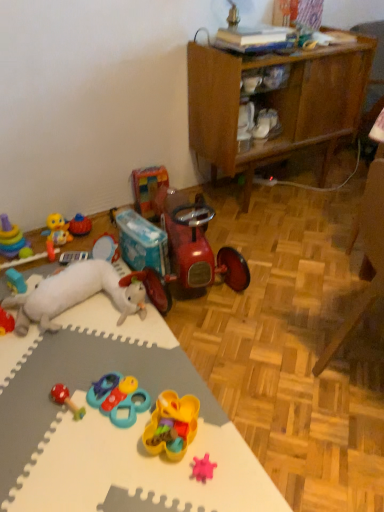
Image resolution: width=384 pixels, height=512 pixels. In order to click on multicolored plastic rings at left, which ranks as the 12th toy in right-to-left order in this screenshot , I will do `click(11, 238)`.

In order to face pink rubber star at lower center, which is counted as the 1th toy, starting from the right, should I rotate leftwards or rightwards?

You should rotate right by 1.676 degrees.

What do you see at coordinates (275, 103) in the screenshot?
I see `wooden cabinet at upper right` at bounding box center [275, 103].

What do you see at coordinates (148, 189) in the screenshot? I see `multicolored plastic blocks at upper center, which ranks as the 4th toy in right-to-left order` at bounding box center [148, 189].

This screenshot has height=512, width=384. What do you see at coordinates (266, 124) in the screenshot?
I see `white matte shoe at center` at bounding box center [266, 124].

Where is `rubberized plastic toy at left, the eleventh toy positioned from the right`? This screenshot has height=512, width=384. rubberized plastic toy at left, the eleventh toy positioned from the right is located at coordinates (31, 257).

The image size is (384, 512). In order to click on multicolored plastic rings at left, which ranks as the 12th toy in right-to-left order in this screenshot , I will do `click(11, 238)`.

In the scene shown: Is rubber duck at center, the 6th toy when ordered from left to right, to the left of white matte shoe at center from the viewer's perspective?

Indeed, rubber duck at center, the 6th toy when ordered from left to right, is positioned on the left side of white matte shoe at center.

Is rubber duck at center, positioned as the 7th toy in right-to-left order, completely or partially outside of white matte shoe at center?

Yes, rubber duck at center, positioned as the 7th toy in right-to-left order, is not within white matte shoe at center.

Considering the sizes of rubber duck at center, the 6th toy when ordered from left to right, and white matte shoe at center in the image, is rubber duck at center, the 6th toy when ordered from left to right, bigger or smaller than white matte shoe at center?

rubber duck at center, the 6th toy when ordered from left to right, is smaller than white matte shoe at center.

Considering the sizes of rubber duck at center, the 6th toy when ordered from left to right, and white matte shoe at center in the image, is rubber duck at center, the 6th toy when ordered from left to right, wider or thinner than white matte shoe at center?

rubber duck at center, the 6th toy when ordered from left to right, is thinner than white matte shoe at center.

Is multicolored plastic rings at left, which ranks as the 12th toy in right-to-left order, facing towards white matte shoe at center?

No, multicolored plastic rings at left, which ranks as the 12th toy in right-to-left order, is not facing towards white matte shoe at center.

Consider the image. Is multicolored plastic rings at left, which ranks as the 12th toy in right-to-left order, closer to camera compared to white matte shoe at center?

Yes, the depth of multicolored plastic rings at left, which ranks as the 12th toy in right-to-left order, is less than that of white matte shoe at center.

Does multicolored plastic rings at left, the first toy viewed from the left, have a greater height compared to white matte shoe at center?

Correct, multicolored plastic rings at left, the first toy viewed from the left, is much taller as white matte shoe at center.

Is wooden cabinet at upper right oriented away from white foam mat at lower left?

No.

From a real-world perspective, is wooden cabinet at upper right below white foam mat at lower left?

No, from a real-world perspective, wooden cabinet at upper right is not beneath white foam mat at lower left.

Does wooden cabinet at upper right come behind white foam mat at lower left?

Yes, wooden cabinet at upper right is behind white foam mat at lower left.

Based on their sizes in the image, would you say wooden cabinet at upper right is bigger or smaller than white foam mat at lower left?

Clearly, wooden cabinet at upper right is larger in size than white foam mat at lower left.

Does multicolored plastic blocks at upper center, placed as the ninth toy when sorted from left to right, have a greater width compared to shiny red tricycle at center, acting as the third toy starting from the right?

Incorrect, the width of multicolored plastic blocks at upper center, placed as the ninth toy when sorted from left to right, does not surpass that of shiny red tricycle at center, acting as the third toy starting from the right.

Which object is closer to the camera, multicolored plastic blocks at upper center, placed as the ninth toy when sorted from left to right, or shiny red tricycle at center, which appears as the 10th toy when viewed from the left?

Positioned in front is shiny red tricycle at center, which appears as the 10th toy when viewed from the left.

Looking at this image, is multicolored plastic blocks at upper center, placed as the ninth toy when sorted from left to right, situated inside shiny red tricycle at center, acting as the third toy starting from the right, or outside?

multicolored plastic blocks at upper center, placed as the ninth toy when sorted from left to right, is spatially situated outside shiny red tricycle at center, acting as the third toy starting from the right.

Does point (148, 217) come closer to viewer compared to point (179, 282)?

No, it is behind (179, 282).

Does white foam mat at lower left turn towards white matte shoe at center?

No, white foam mat at lower left is not oriented towards white matte shoe at center.

Does white foam mat at lower left appear on the right side of white matte shoe at center?

In fact, white foam mat at lower left is to the left of white matte shoe at center.

Is the position of white foam mat at lower left more distant than that of white matte shoe at center?

That is False.

Is white foam mat at lower left taller than white matte shoe at center?

No, white foam mat at lower left is not taller than white matte shoe at center.

Is rubberized red and green toy at lower left, the 7th toy from the left, facing towards wooden cabinet at upper right?

No, rubberized red and green toy at lower left, the 7th toy from the left, is not turned towards wooden cabinet at upper right.

From a real-world perspective, is rubberized red and green toy at lower left, the 6th toy positioned from the right, above or below wooden cabinet at upper right?

From a real-world perspective, rubberized red and green toy at lower left, the 6th toy positioned from the right, is physically below wooden cabinet at upper right.

Is rubberized red and green toy at lower left, the 7th toy from the left, at the right side of wooden cabinet at upper right?

In fact, rubberized red and green toy at lower left, the 7th toy from the left, is to the left of wooden cabinet at upper right.

Who is bigger, rubberized red and green toy at lower left, the 7th toy from the left, or wooden cabinet at upper right?

Bigger between the two is wooden cabinet at upper right.

Could you tell me if rubber duck at center, positioned as the 7th toy in right-to-left order, is facing rubberized plastic toy at left, the eleventh toy positioned from the right?

Yes, rubber duck at center, positioned as the 7th toy in right-to-left order, is oriented towards rubberized plastic toy at left, the eleventh toy positioned from the right.

From a real-world perspective, is rubber duck at center, positioned as the 7th toy in right-to-left order, over rubberized plastic toy at left, which ranks as the second toy in left-to-right order?

Yes.

From the image's perspective, relative to rubberized plastic toy at left, which ranks as the second toy in left-to-right order, is rubber duck at center, the 6th toy when ordered from left to right, above or below?

rubber duck at center, the 6th toy when ordered from left to right, is situated higher than rubberized plastic toy at left, which ranks as the second toy in left-to-right order, in the image.

Can you confirm if rubber duck at center, positioned as the 7th toy in right-to-left order, is positioned to the left of rubberized plastic toy at left, which ranks as the second toy in left-to-right order?

No.

You are a GUI agent. You are given a task and a screenshot of the screen. Output one action in this format:
    pyautogui.click(x=<x>, y=<y>)
    Task: Click on the footwear on the right of rubber duck at center, the 6th toy when ordered from left to right
    This screenshot has height=512, width=384.
    Given the screenshot: What is the action you would take?
    pyautogui.click(x=266, y=124)

The height and width of the screenshot is (512, 384). I want to click on footwear behind the multicolored plastic rings at left, the first toy viewed from the left, so click(x=266, y=124).

From the image, which object appears to be farther from shiny red tricycle at center, acting as the third toy starting from the right, pink rubber star at lower center, which is counted as the 1th toy, starting from the right, or multicolored plastic blocks at upper center, placed as the ninth toy when sorted from left to right?

pink rubber star at lower center, which is counted as the 1th toy, starting from the right, is further to shiny red tricycle at center, acting as the third toy starting from the right.

Based on their spatial positions, is shiny red tricycle at center, which appears as the 10th toy when viewed from the left, or rubberized red and green toy at lower left, the 6th toy positioned from the right, closer to white foam mat at lower left?

Among the two, rubberized red and green toy at lower left, the 6th toy positioned from the right, is located nearer to white foam mat at lower left.

Based on their spatial positions, is teal plastic toy at center, the eighth toy viewed from the left, or pink rubber star at lower center, placed as the twelfth toy when sorted from left to right, further from rubberized red and green toy at lower left, the 7th toy from the left?

Among the two, pink rubber star at lower center, placed as the twelfth toy when sorted from left to right, is located further to rubberized red and green toy at lower left, the 7th toy from the left.

Based on the photo, when comparing their distances from rubberized plastic toy at left, which ranks as the second toy in left-to-right order, does rubber duck at left, positioned as the ninth toy in right-to-left order, or shiny red tricycle at center, which appears as the 10th toy when viewed from the left, seem further?

Based on the image, shiny red tricycle at center, which appears as the 10th toy when viewed from the left, appears to be further to rubberized plastic toy at left, which ranks as the second toy in left-to-right order.

Consider the image. Based on their spatial positions, is wooden cabinet at upper right or rubberized red and green toy at lower left, the 6th toy positioned from the right, closer to teal plastic toy at center, the eighth toy viewed from the left?

The object closer to teal plastic toy at center, the eighth toy viewed from the left, is rubberized red and green toy at lower left, the 6th toy positioned from the right.

Estimate the real-world distances between objects in this image. Which object is closer to shiny red tricycle at center, acting as the third toy starting from the right, rubberized red and green toy at lower left, the 6th toy positioned from the right, or white matte shoe at center?

rubberized red and green toy at lower left, the 6th toy positioned from the right, is positioned closer to the anchor shiny red tricycle at center, acting as the third toy starting from the right.

Estimate the real-world distances between objects in this image. Which object is further from rubberized plastic toy at left, the eleventh toy positioned from the right, shiny red tricycle at center, acting as the third toy starting from the right, or pink rubber star at lower center, placed as the twelfth toy when sorted from left to right?

pink rubber star at lower center, placed as the twelfth toy when sorted from left to right, is positioned further to the anchor rubberized plastic toy at left, the eleventh toy positioned from the right.

From the image, which object appears to be farther from white matte shoe at center, rubber duck at left, positioned as the ninth toy in right-to-left order, or multicolored plastic blocks at upper center, which ranks as the 4th toy in right-to-left order?

rubber duck at left, positioned as the ninth toy in right-to-left order, lies further to white matte shoe at center than the other object.

Locate an element on the screen. The width and height of the screenshot is (384, 512). footwear located between rubber duck at center, positioned as the 7th toy in right-to-left order, and wooden cabinet at upper right in the left-right direction is located at coordinates (266, 124).

What are the coordinates of `desk that lies between wooden cabinet at upper right and pink rubber star at lower center, placed as the twelfth toy when sorted from left to right, from top to bottom` in the screenshot? It's located at (119, 437).

Where is `toy located between white plush toy at upper left, the eighth toy when ordered from right to left, and rubberized plastic toy at left, which ranks as the second toy in left-to-right order, in the depth direction`? This screenshot has height=512, width=384. toy located between white plush toy at upper left, the eighth toy when ordered from right to left, and rubberized plastic toy at left, which ranks as the second toy in left-to-right order, in the depth direction is located at coordinates (15, 281).

You are a GUI agent. You are given a task and a screenshot of the screen. Output one action in this format:
    pyautogui.click(x=<x>, y=<y>)
    Task: Click on the desk that lies between white matte shoe at center and teal plastic toy at center, the eighth toy viewed from the left, from top to bottom
    The width and height of the screenshot is (384, 512).
    Given the screenshot: What is the action you would take?
    pyautogui.click(x=119, y=437)